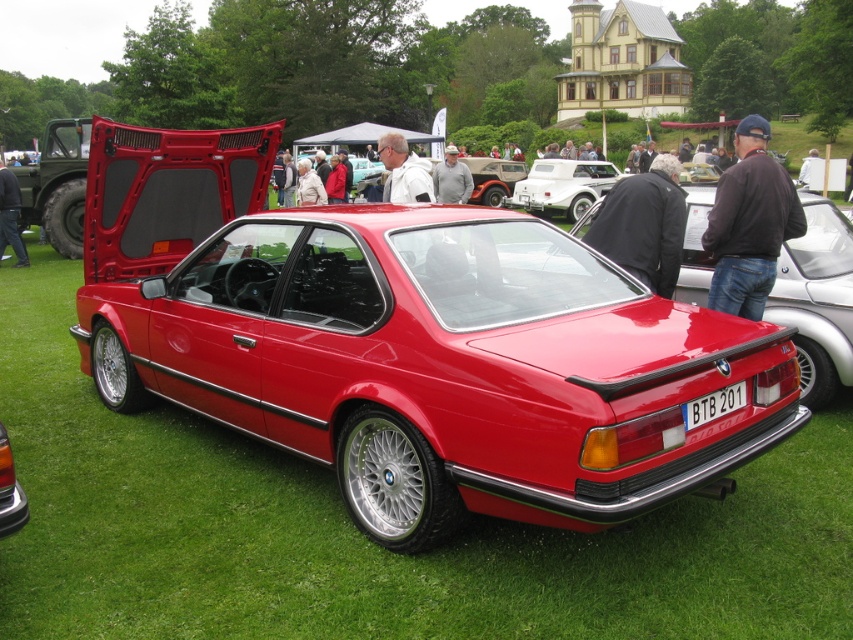
Does white matte convertible at center have a smaller size compared to jeans at lower left?

Actually, white matte convertible at center might be larger than jeans at lower left.

Is point (547, 195) closer to viewer compared to point (4, 189)?

No.

I want to click on white matte convertible at center, so click(563, 186).

Find the location of `glossy red car at center`. glossy red car at center is located at coordinates (817, 300).

Looking at this image, between glossy red car at center and white matte jacket at center, which one has less height?

white matte jacket at center is shorter.

Does point (704, 252) come in front of point (387, 176)?

Yes.

I want to click on glossy red car at center, so click(x=817, y=300).

Is black leather jacket at center wider than white matte convertible at center?

No, black leather jacket at center is not wider than white matte convertible at center.

Identify the location of black leather jacket at center. (643, 225).